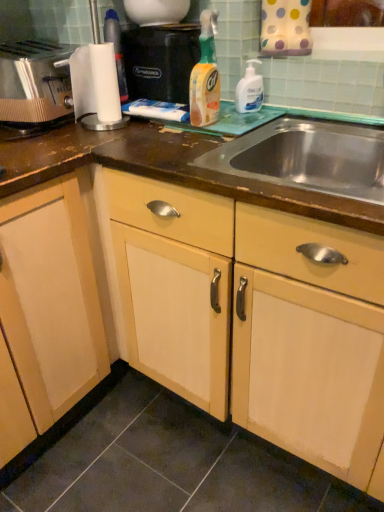
Question: Which direction should I rotate to face translucent plastic spray bottle at center, which is the second cleaning product from right to left, — up or down?

Choices:
 (A) up
 (B) down

Answer: (A)

Question: Considering the relative positions of stainless steel sink at center and translucent plastic spray bottle at center, which is the second cleaning product from right to left, in the image provided, is stainless steel sink at center to the right of translucent plastic spray bottle at center, which is the second cleaning product from right to left, from the viewer's perspective?

Choices:
 (A) no
 (B) yes

Answer: (B)

Question: Would you say stainless steel sink at center is a long distance from translucent plastic spray bottle at center, arranged as the first cleaning product when viewed from the left?

Choices:
 (A) yes
 (B) no

Answer: (B)

Question: Is stainless steel sink at center to the left of translucent plastic spray bottle at center, which is the second cleaning product from right to left, from the viewer's perspective?

Choices:
 (A) no
 (B) yes

Answer: (A)

Question: From the image's perspective, would you say stainless steel sink at center is shown under translucent plastic spray bottle at center, arranged as the first cleaning product when viewed from the left?

Choices:
 (A) no
 (B) yes

Answer: (B)

Question: Considering the relative sizes of stainless steel sink at center and translucent plastic spray bottle at center, which is the second cleaning product from right to left, in the image provided, is stainless steel sink at center bigger than translucent plastic spray bottle at center, which is the second cleaning product from right to left,?

Choices:
 (A) yes
 (B) no

Answer: (A)

Question: Can you confirm if stainless steel sink at center is taller than translucent plastic spray bottle at center, arranged as the first cleaning product when viewed from the left?

Choices:
 (A) no
 (B) yes

Answer: (A)

Question: Is white glossy pump bottle at upper right, which ranks as the 2th cleaning product in left-to-right order, closer to camera compared to stainless steel sink at center?

Choices:
 (A) yes
 (B) no

Answer: (B)

Question: Does white glossy pump bottle at upper right, which ranks as the 2th cleaning product in left-to-right order, have a lesser width compared to stainless steel sink at center?

Choices:
 (A) no
 (B) yes

Answer: (B)

Question: Could you tell me if white glossy pump bottle at upper right, which ranks as the 2th cleaning product in left-to-right order, is turned towards stainless steel sink at center?

Choices:
 (A) yes
 (B) no

Answer: (B)

Question: Does white glossy pump bottle at upper right, acting as the 1th cleaning product starting from the right, appear on the right side of stainless steel sink at center?

Choices:
 (A) yes
 (B) no

Answer: (B)

Question: Considering the relative sizes of white glossy pump bottle at upper right, acting as the 1th cleaning product starting from the right, and stainless steel sink at center in the image provided, is white glossy pump bottle at upper right, acting as the 1th cleaning product starting from the right, bigger than stainless steel sink at center?

Choices:
 (A) yes
 (B) no

Answer: (B)

Question: Is white glossy pump bottle at upper right, acting as the 1th cleaning product starting from the right, facing away from stainless steel sink at center?

Choices:
 (A) no
 (B) yes

Answer: (A)

Question: Is black plastic coffee machine at upper center taller than stainless steel sink at center?

Choices:
 (A) no
 (B) yes

Answer: (B)